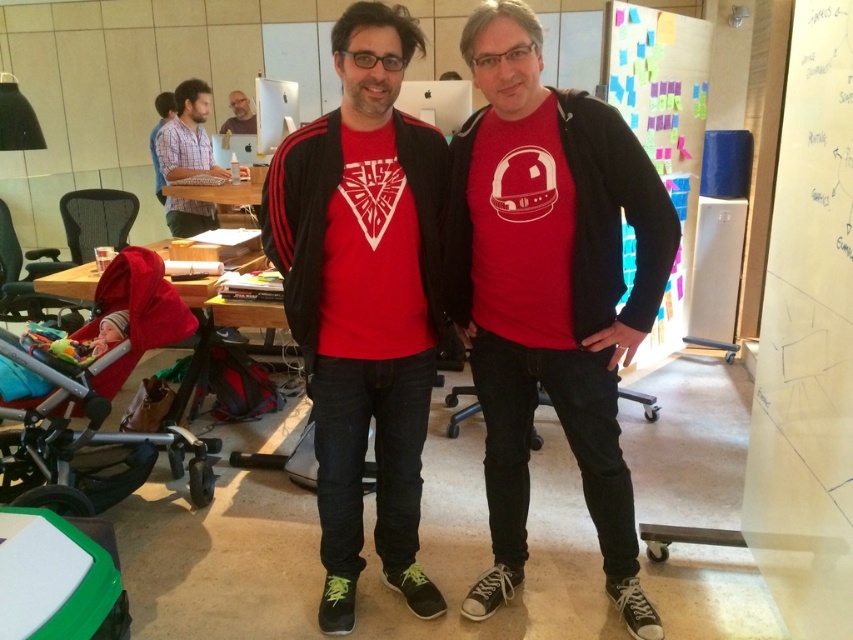
You are an office worker who needs to locate the matte black laptop at upper left. From your current position facing the scene, which direction should you move to reach it first, considering the matte black jacket at center is blocking your path?

The matte black jacket at center is to the right of the matte black laptop at upper left, so you should move to your left to reach the matte black laptop at upper left first as it is positioned to the left of the blocking jacket.